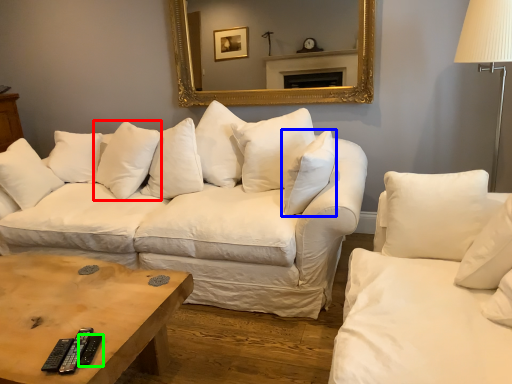
Question: Based on their relative distances, which object is nearer to pillow (highlighted by a red box)? Choose from pillow (highlighted by a blue box) and remote (highlighted by a green box).

Choices:
 (A) pillow
 (B) remote

Answer: (A)